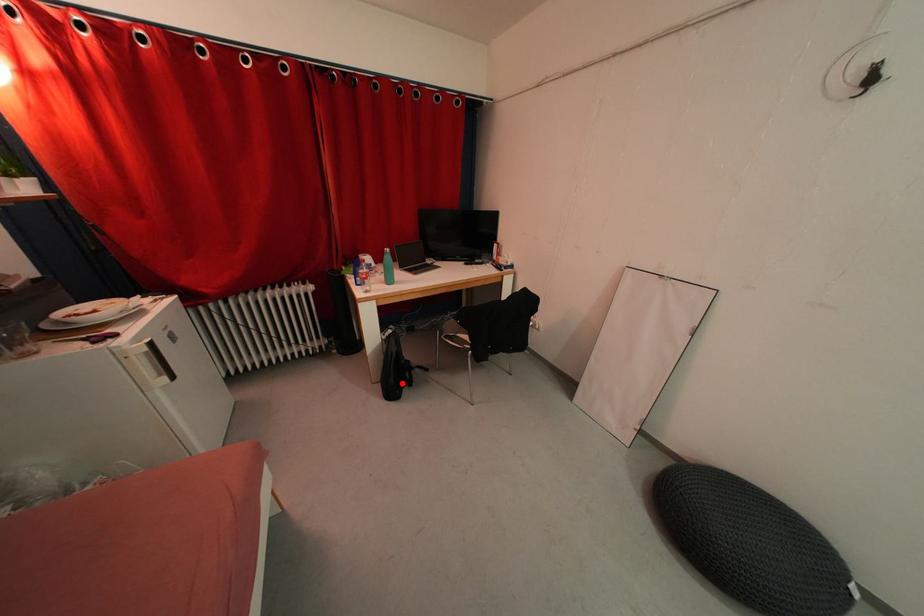
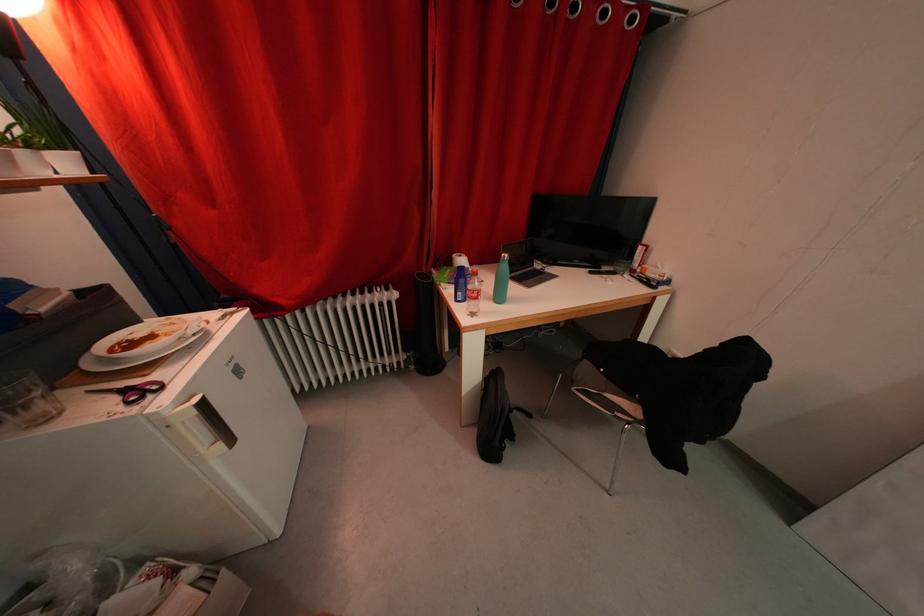
Where in the second image is the point corresponding to the highlighted location from the first image?

(500, 432)